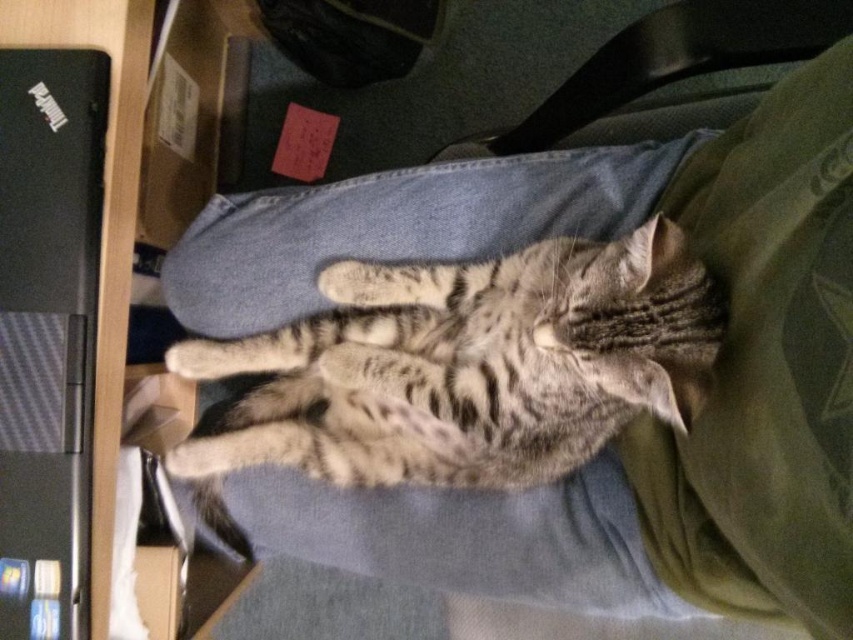
Question: Which point appears farthest from the camera in this image?

Choices:
 (A) (65, 170)
 (B) (654, 232)

Answer: (A)

Question: Which point is closer to the camera taking this photo?

Choices:
 (A) (498, 394)
 (B) (38, 554)

Answer: (B)

Question: Does tabby fur cat at center have a lesser width compared to black carbon fiber laptop at left?

Choices:
 (A) yes
 (B) no

Answer: (B)

Question: Which point is farther to the camera?

Choices:
 (A) (434, 278)
 (B) (90, 410)

Answer: (A)

Question: Is tabby fur cat at center closer to camera compared to black carbon fiber laptop at left?

Choices:
 (A) yes
 (B) no

Answer: (A)

Question: Can you confirm if tabby fur cat at center is wider than black carbon fiber laptop at left?

Choices:
 (A) yes
 (B) no

Answer: (A)